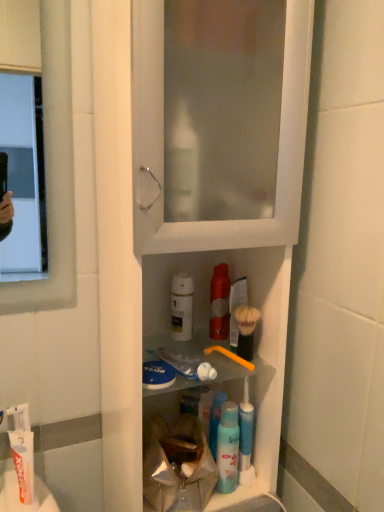
Question: From the image's perspective, does white glossy lotion at center appear lower than yellow plastic toothbrush at center-right?

Choices:
 (A) no
 (B) yes

Answer: (A)

Question: Considering the relative sizes of white glossy lotion at center and yellow plastic toothbrush at center-right in the image provided, is white glossy lotion at center smaller than yellow plastic toothbrush at center-right?

Choices:
 (A) no
 (B) yes

Answer: (A)

Question: Is white glossy lotion at center next to yellow plastic toothbrush at center-right and touching it?

Choices:
 (A) yes
 (B) no

Answer: (B)

Question: Is white glossy lotion at center aimed at yellow plastic toothbrush at center-right?

Choices:
 (A) no
 (B) yes

Answer: (A)

Question: Considering the relative positions of white glossy lotion at center and yellow plastic toothbrush at center-right in the image provided, is white glossy lotion at center to the left of yellow plastic toothbrush at center-right from the viewer's perspective?

Choices:
 (A) yes
 (B) no

Answer: (A)

Question: Is point (230, 479) positioned closer to the camera than point (188, 317)?

Choices:
 (A) closer
 (B) farther

Answer: (A)

Question: Is blue plastic mouthwash at center wider or thinner than white glossy lotion at center?

Choices:
 (A) thin
 (B) wide

Answer: (A)

Question: Is blue plastic mouthwash at center inside or outside of white glossy lotion at center?

Choices:
 (A) outside
 (B) inside

Answer: (A)

Question: From a real-world perspective, is blue plastic mouthwash at center above or below white glossy lotion at center?

Choices:
 (A) below
 (B) above

Answer: (A)

Question: From a real-world perspective, relative to white glossy lotion at center, is white plastic cabinet at center vertically above or below?

Choices:
 (A) below
 (B) above

Answer: (B)

Question: In terms of size, does white plastic cabinet at center appear bigger or smaller than white glossy lotion at center?

Choices:
 (A) small
 (B) big

Answer: (B)

Question: In terms of width, does white plastic cabinet at center look wider or thinner when compared to white glossy lotion at center?

Choices:
 (A) thin
 (B) wide

Answer: (B)

Question: Is white plastic cabinet at center in front of or behind white glossy lotion at center in the image?

Choices:
 (A) front
 (B) behind

Answer: (A)

Question: In terms of height, does yellow plastic toothbrush at center-right look taller or shorter compared to white plastic cabinet at center?

Choices:
 (A) tall
 (B) short

Answer: (B)

Question: Relative to white plastic cabinet at center, is yellow plastic toothbrush at center-right in front or behind?

Choices:
 (A) behind
 (B) front

Answer: (A)